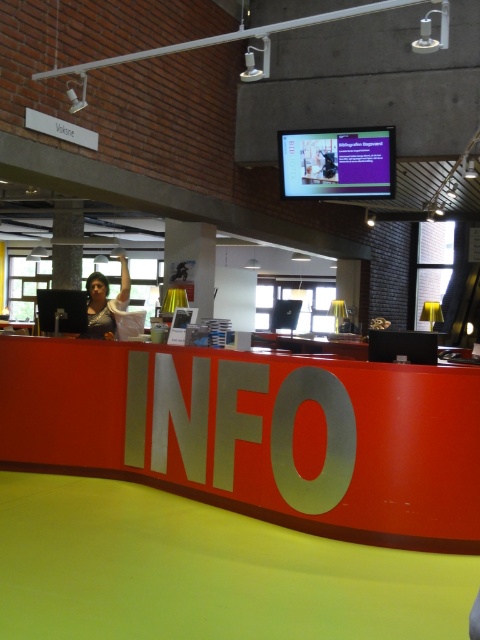
You are a visitor at the library and see the red matte info sign at center and the white fabric shirt at left. Which object is closer to the front of the scene?

The white fabric shirt at left is closer to the front because the red matte info sign at center is positioned under it, indicating it is behind.

What is the 2D coordinate of the red matte info sign at center?

The red matte info sign at center is located at the 2D coordinate point of (256, 433).